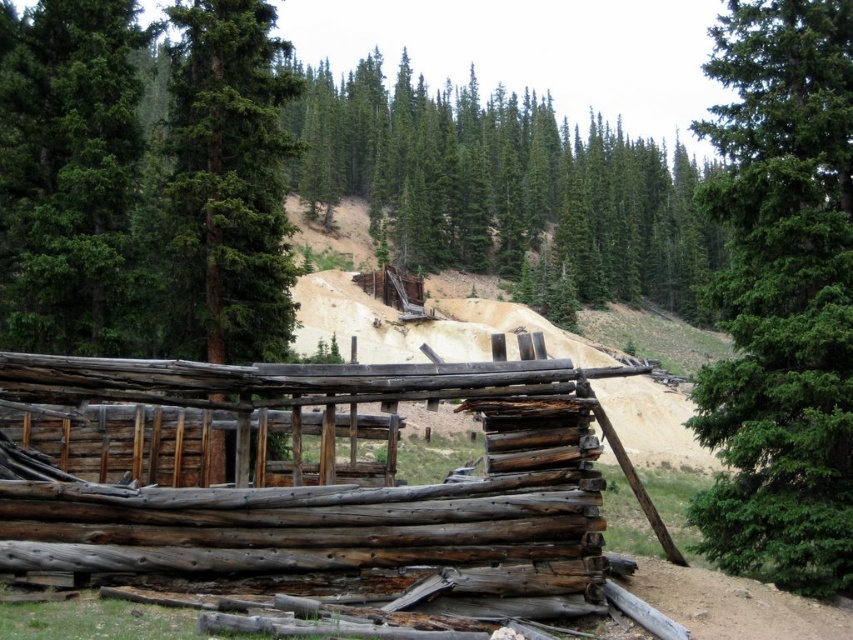
Is green textured pine at upper right taller than green textured tree at left?

Correct, green textured pine at upper right is much taller as green textured tree at left.

Between point (815, 204) and point (38, 348), which one is positioned behind?

Positioned behind is point (38, 348).

Between point (834, 77) and point (39, 54), which one is positioned in front?

Positioned in front is point (834, 77).

Find the location of a particular element. The image size is (853, 640). green textured pine at upper right is located at coordinates (781, 296).

Can you confirm if green textured tree at left is positioned above brown dirt track at lower right?

Yes.

Which is in front, point (70, 17) or point (712, 602)?

Point (712, 602)

Who is more forward, (x=115, y=106) or (x=666, y=586)?

Point (x=666, y=586)

This screenshot has height=640, width=853. In order to click on green textured tree at left in this screenshot , I will do `click(68, 177)`.

Is green textured pine at upper right to the right of brown dirt track at lower right from the viewer's perspective?

Yes, green textured pine at upper right is to the right of brown dirt track at lower right.

Can you confirm if green textured pine at upper right is positioned below brown dirt track at lower right?

Actually, green textured pine at upper right is above brown dirt track at lower right.

Find the location of a particular element. green textured pine at upper right is located at coordinates (781, 296).